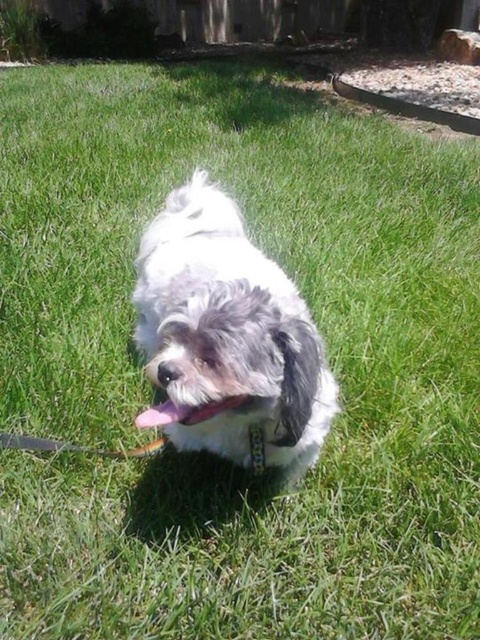
You are holding a leash attached to a small dog on a sunny day. You want to know if you can safely step back 1 meter without the leash becoming taut. The leash is attached to the point labeled point [238,308]. Can you step back 1 meter?

The distance between you and the point [238,308] is 1.14 meters. If you step back 1 meter, there will still be 0.14 meters of slack in the leash, so yes, you can safely step back 1 meter without the leash becoming taut.

You are a dog owner trying to attach a new tag to your dog. The tag needs to be placed 10 inches away from the pink fabric mouth at center. Can the tag be attached to the black fabric neckband at center?

The pink fabric mouth at center is 9.52 inches from the black fabric neckband at center. Since the required distance is 10 inches, the tag cannot be attached to the black fabric neckband at center as it is slightly closer than needed.

You are a photographer taking a closeup shot of the small dog. You need to focus on the pink fabric mouth at center and the black fabric neckband at center. Which object is positioned more to the left in the image?

The pink fabric mouth at center is positioned to the left of the black fabric neckband at center.